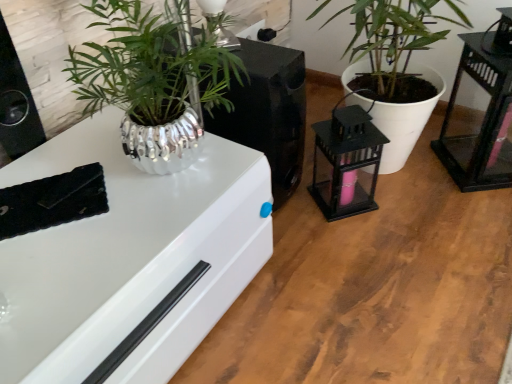
The image size is (512, 384). I want to click on vacant space that's between black glass table at right and white matte plant pot at center, so click(x=442, y=175).